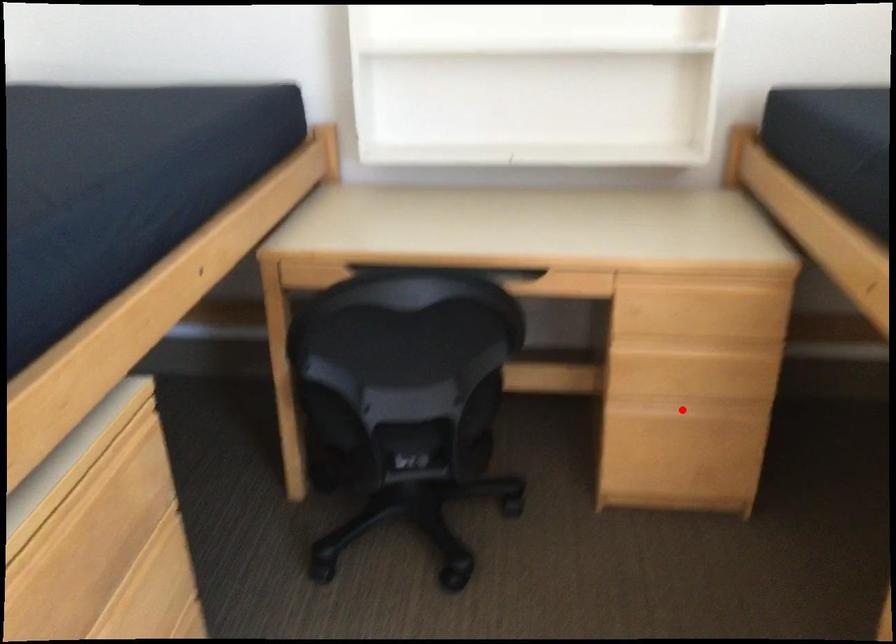
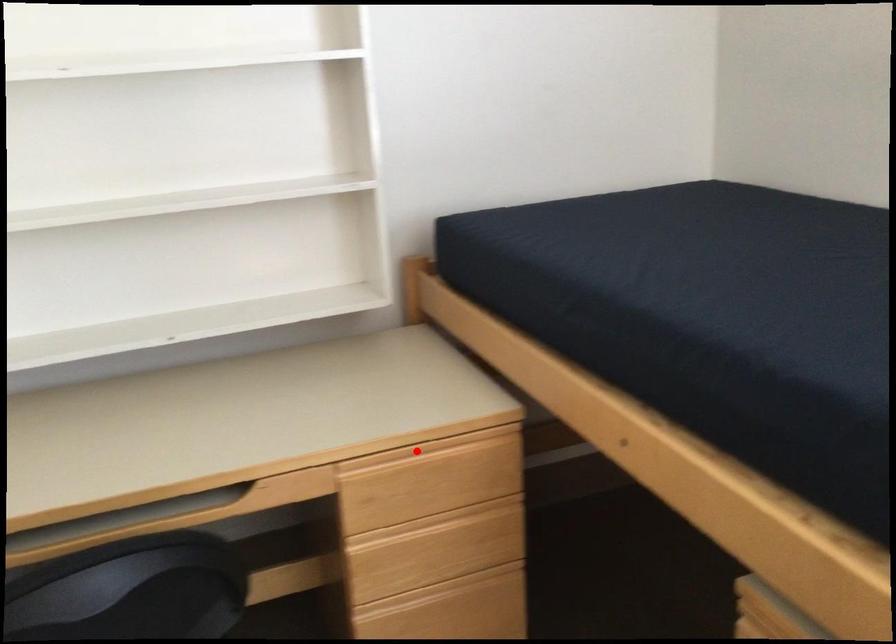
I am providing you with two images of the same scene from different viewpoints. A red point is marked on the first image and another point is marked on the second image. Do the highlighted points in image1 and image2 indicate the same real-world spot?

No